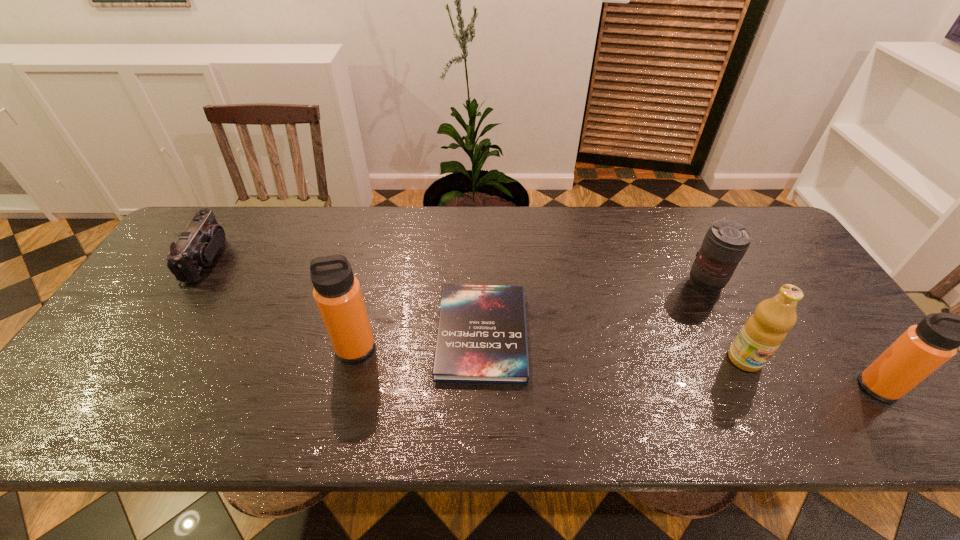
Where is `free spot that satisfies the following two spatial constraints: 1. on the front-facing side of the taller thermos bottle; 2. on the left side of the fifth tallest object`? The height and width of the screenshot is (540, 960). free spot that satisfies the following two spatial constraints: 1. on the front-facing side of the taller thermos bottle; 2. on the left side of the fifth tallest object is located at coordinates pyautogui.click(x=150, y=348).

Locate an element on the screen. free point that satisfies the following two spatial constraints: 1. on the side of the shorter thermos bottle where the control switches are located; 2. on the left side of the third shortest object is located at coordinates (756, 387).

The width and height of the screenshot is (960, 540). Find the location of `free space in the image that satisfies the following two spatial constraints: 1. on the front-facing side of the camcorder; 2. on the back side of the third object from left to right`. free space in the image that satisfies the following two spatial constraints: 1. on the front-facing side of the camcorder; 2. on the back side of the third object from left to right is located at coordinates (159, 334).

Locate an element on the screen. The height and width of the screenshot is (540, 960). free space that satisfies the following two spatial constraints: 1. on the front-facing side of the shorter thermos bottle; 2. on the right side of the second shortest object is located at coordinates (124, 387).

Find the location of a particular element. free space that satisfies the following two spatial constraints: 1. on the front side of the shorter thermos bottle; 2. on the left side of the left thermos bottle is located at coordinates (346, 387).